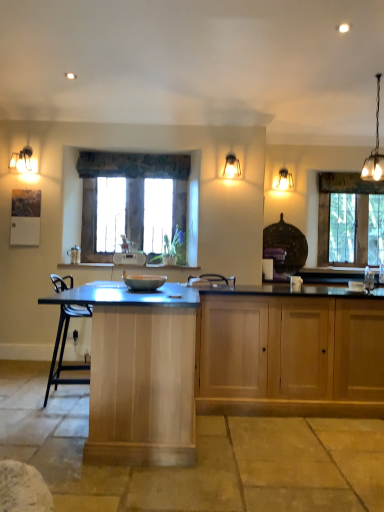
The height and width of the screenshot is (512, 384). I want to click on free space that is to the left of light wood cabinet at center, marked as the 2th cabinetry in a right-to-left arrangement, so click(29, 407).